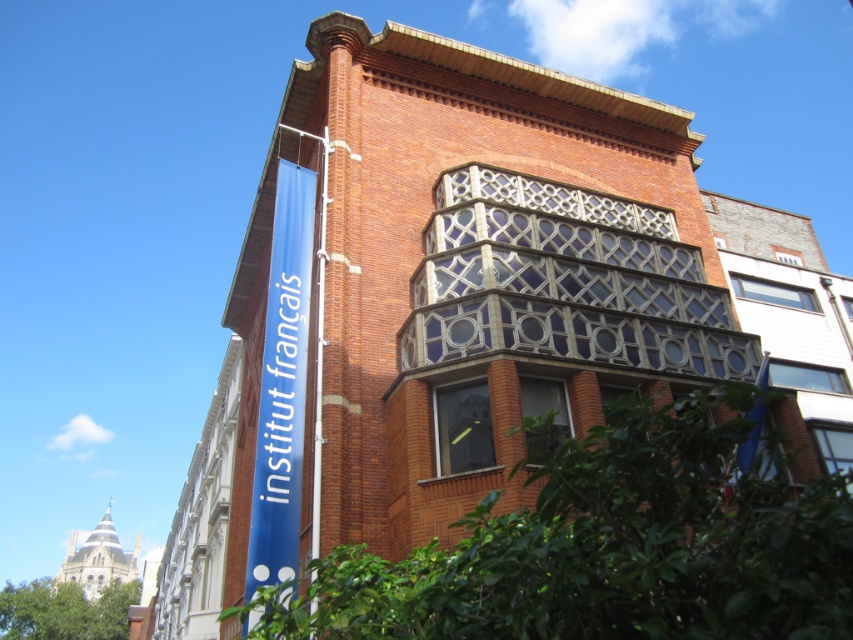
Between clear glass balcony at center and blue fabric sign at left, which one appears on the left side from the viewer's perspective?

Positioned to the left is blue fabric sign at left.

I want to click on clear glass balcony at center, so click(x=564, y=282).

Locate an element on the screen. The height and width of the screenshot is (640, 853). clear glass balcony at center is located at coordinates (564, 282).

Who is more forward, (283,221) or (318,477)?

Point (318,477) is more forward.

Does blue fabric sign at left appear on the right side of metallic silver pole at upper center?

In fact, blue fabric sign at left is to the left of metallic silver pole at upper center.

Identify the location of blue fabric sign at left. Image resolution: width=853 pixels, height=640 pixels. [282, 387].

Is point (456, 336) less distant than point (317, 356)?

Yes, point (456, 336) is closer to viewer.

Between clear glass balcony at center and metallic silver pole at upper center, which one is positioned lower?

metallic silver pole at upper center

Is point (610, 330) closer to viewer compared to point (320, 349)?

No, it is not.

At what (x,y) coordinates should I click in order to perform the action: click on clear glass balcony at center. Please return your answer as a coordinate pair (x, y). Looking at the image, I should click on (564, 282).